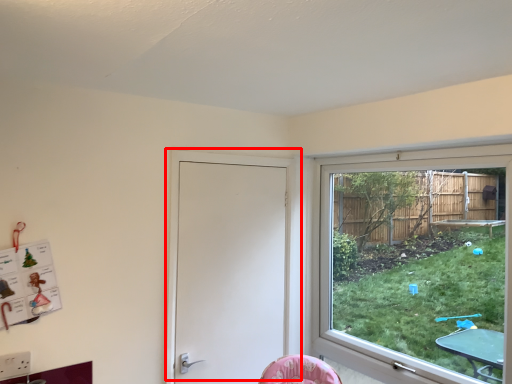
Question: From the image's perspective, considering the relative positions of door (annotated by the red box) and window in the image provided, where is door (annotated by the red box) located with respect to the staircase?

Choices:
 (A) above
 (B) below

Answer: (B)